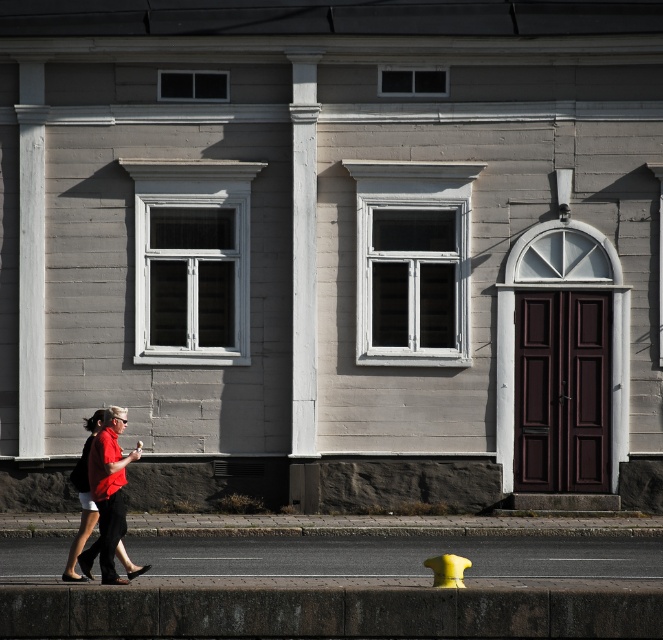
The image size is (663, 640). What do you see at coordinates (398, 556) in the screenshot?
I see `smooth concrete sidewalk at lower center` at bounding box center [398, 556].

Does smooth concrete sidewalk at lower center appear over matte red shirt at lower left?

Incorrect, smooth concrete sidewalk at lower center is not positioned above matte red shirt at lower left.

Between point (402, 538) and point (113, 508), which one is positioned in front?

Point (113, 508) is more forward.

You are a GUI agent. You are given a task and a screenshot of the screen. Output one action in this format:
    pyautogui.click(x=<x>, y=<y>)
    Task: Click on the smooth concrete sidewalk at lower center
    
    Given the screenshot: What is the action you would take?
    pyautogui.click(x=398, y=556)

Is matte red shirt at lower left shorter than yellow rubber hydrant at lower center?

Incorrect, matte red shirt at lower left's height does not fall short of yellow rubber hydrant at lower center's.

Who is shorter, matte red shirt at lower left or yellow rubber hydrant at lower center?

With less height is yellow rubber hydrant at lower center.

Is point (115, 451) in front of point (440, 570)?

No, (115, 451) is further to viewer.

Where is `matte red shirt at lower left`? The image size is (663, 640). matte red shirt at lower left is located at coordinates point(107,497).

Can you confirm if smooth concrete sidewalk at lower center is positioned below yellow rubber hydrant at lower center?

Correct, smooth concrete sidewalk at lower center is located below yellow rubber hydrant at lower center.

Does point (469, 568) come behind point (444, 577)?

Yes.

This screenshot has width=663, height=640. Describe the element at coordinates (398, 556) in the screenshot. I see `smooth concrete sidewalk at lower center` at that location.

Locate an element on the screen. Image resolution: width=663 pixels, height=640 pixels. smooth concrete sidewalk at lower center is located at coordinates (398, 556).